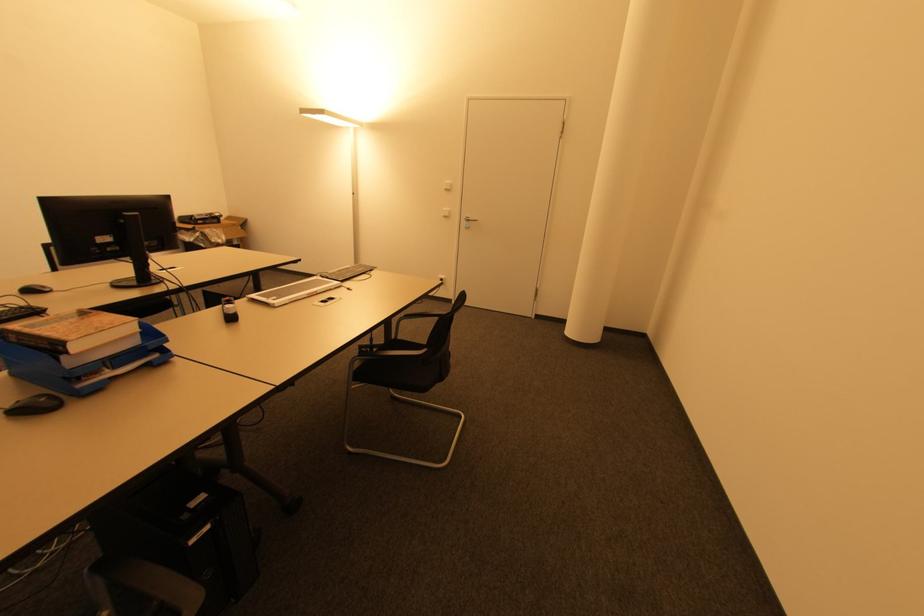
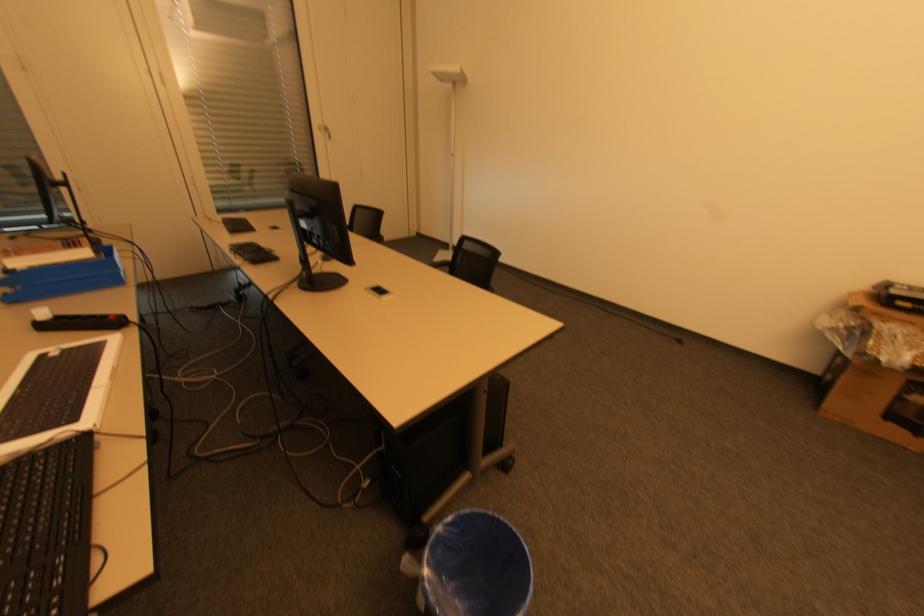
Find the pixel in the second image that matches (200,237) in the first image.

(850, 328)